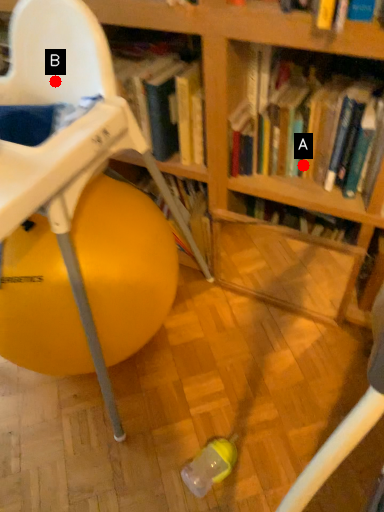
Question: Two points are circled on the image, labeled by A and B beside each circle. Which point is farther from the camera taking this photo?

Choices:
 (A) A is further
 (B) B is further

Answer: (A)